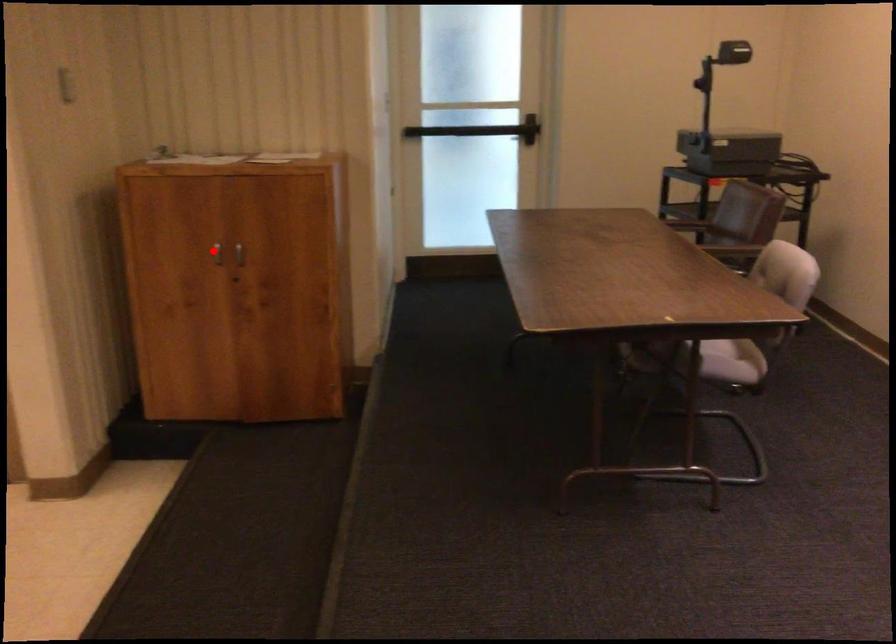
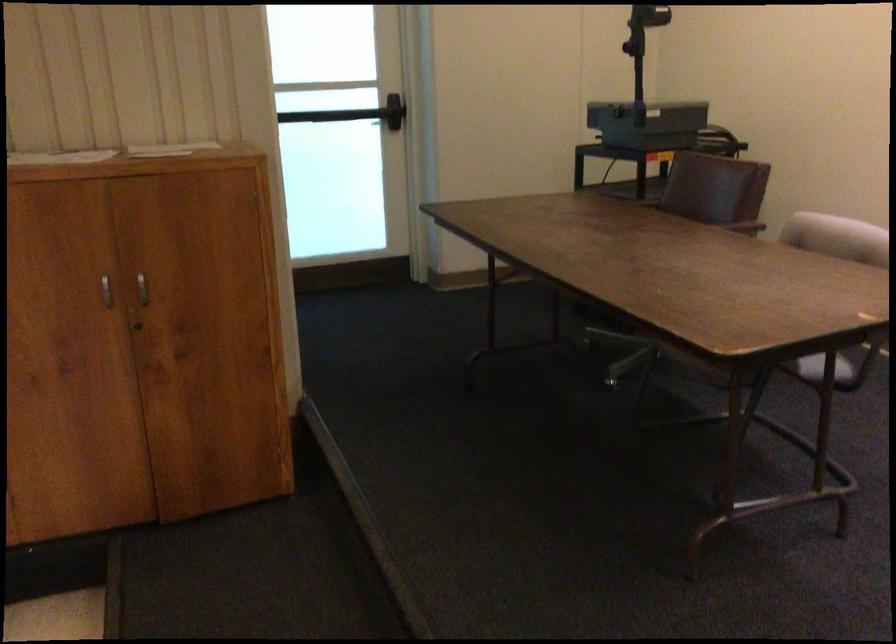
Question: I am providing you with two images of the same scene from different viewpoints. Image1 has a red point marked. In image2, the corresponding 3D location appears at what relative position? Reply with the corresponding letter.

Choices:
 (A) Closer
 (B) Farther

Answer: (A)